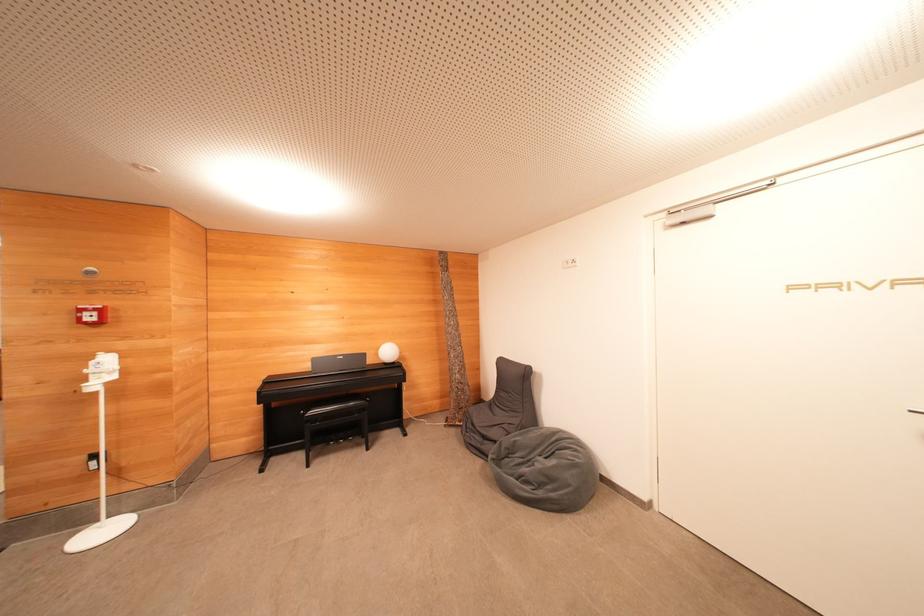
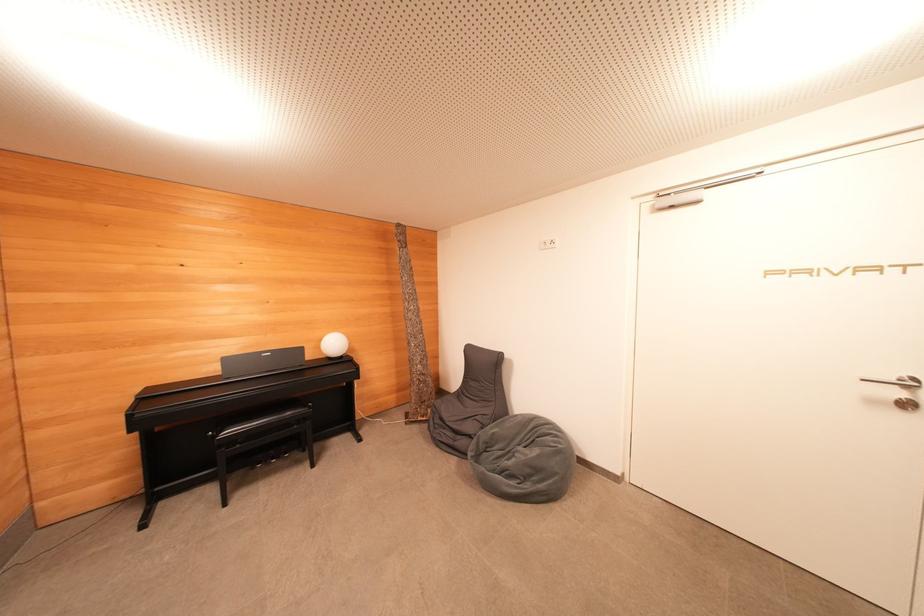
Where in the second image is the point corresponding to point 392,355 from the first image?

(337, 347)